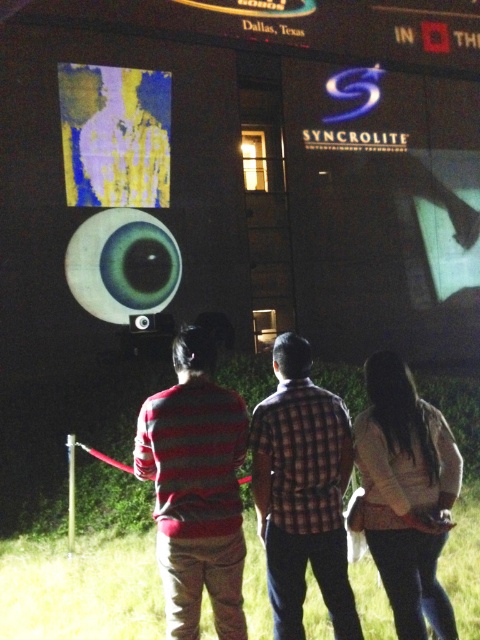
Question: Which point is farther from the camera taking this photo?

Choices:
 (A) (155, 81)
 (B) (216, 417)

Answer: (A)

Question: Estimate the real-world distances between objects in this image. Which object is farther from the matte black speaker at center?

Choices:
 (A) white matte shirt at center
 (B) plaid shirt at center
 (C) striped sweater at center
 (D) yellow fabric screen at upper left

Answer: (A)

Question: Which point is closer to the camera taking this photo?

Choices:
 (A) (420, 442)
 (B) (92, 92)
 (C) (141, 317)

Answer: (A)

Question: Is striped sweater at center smaller than matte black speaker at center?

Choices:
 (A) yes
 (B) no

Answer: (B)

Question: Is striped sweater at center closer to the viewer compared to matte black speaker at center?

Choices:
 (A) no
 (B) yes

Answer: (B)

Question: From the image, what is the correct spatial relationship of plaid shirt at center in relation to matte black speaker at center?

Choices:
 (A) below
 (B) above

Answer: (A)